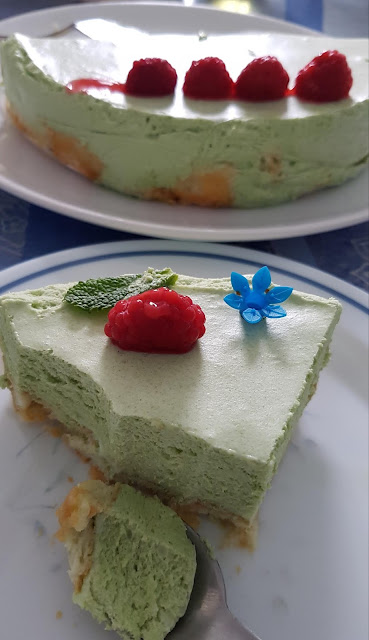
Where is `plate`? The image size is (369, 640). plate is located at coordinates (311, 556), (30, 180).